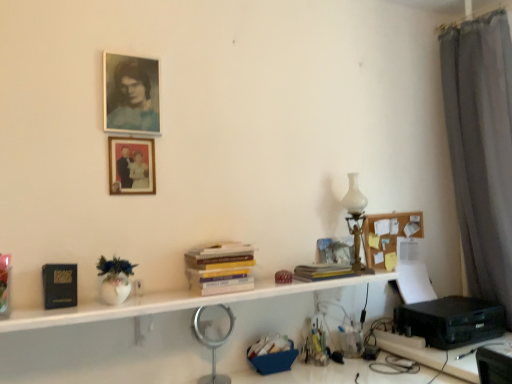
Question: Considering the relative sizes of corkboard at upper right and matte paper portrait at upper left, which appears as the 2th picture frame when ordered from the bottom, in the image provided, is corkboard at upper right shorter than matte paper portrait at upper left, which appears as the 2th picture frame when ordered from the bottom,?

Choices:
 (A) yes
 (B) no

Answer: (A)

Question: Does corkboard at upper right come in front of matte paper portrait at upper left, which appears as the 2th picture frame when ordered from the bottom?

Choices:
 (A) no
 (B) yes

Answer: (A)

Question: Is matte paper portrait at upper left, arranged as the 1th picture frame when viewed from the top, a part of corkboard at upper right?

Choices:
 (A) yes
 (B) no

Answer: (B)

Question: Does corkboard at upper right turn towards matte paper portrait at upper left, arranged as the 1th picture frame when viewed from the top?

Choices:
 (A) no
 (B) yes

Answer: (A)

Question: Does corkboard at upper right touch matte paper portrait at upper left, which appears as the 2th picture frame when ordered from the bottom?

Choices:
 (A) no
 (B) yes

Answer: (A)

Question: Looking at their shapes, would you say black plastic printer at lower right is wider or thinner than white matte shelf at center?

Choices:
 (A) wide
 (B) thin

Answer: (A)

Question: Is point (460, 317) closer or farther from the camera than point (120, 307)?

Choices:
 (A) farther
 (B) closer

Answer: (A)

Question: Is black plastic printer at lower right taller or shorter than white matte shelf at center?

Choices:
 (A) short
 (B) tall

Answer: (B)

Question: Considering their positions, is black plastic printer at lower right located in front of or behind white matte shelf at center?

Choices:
 (A) behind
 (B) front

Answer: (A)

Question: Considering the positions of yellow paperbacks at center, positioned as the 1th book in left-to-right order, and corkboard at upper right in the image, is yellow paperbacks at center, positioned as the 1th book in left-to-right order, bigger or smaller than corkboard at upper right?

Choices:
 (A) small
 (B) big

Answer: (B)

Question: Relative to corkboard at upper right, is yellow paperbacks at center, the second book from the right, in front or behind?

Choices:
 (A) front
 (B) behind

Answer: (A)

Question: From the image's perspective, relative to corkboard at upper right, is yellow paperbacks at center, the second book from the right, above or below?

Choices:
 (A) above
 (B) below

Answer: (B)

Question: Looking at their shapes, would you say yellow paperbacks at center, the second book from the right, is wider or thinner than corkboard at upper right?

Choices:
 (A) thin
 (B) wide

Answer: (B)

Question: Is silver metallic magnifying glass at center taller or shorter than corkboard at upper right?

Choices:
 (A) tall
 (B) short

Answer: (A)

Question: From the image's perspective, is silver metallic magnifying glass at center positioned above or below corkboard at upper right?

Choices:
 (A) below
 (B) above

Answer: (A)